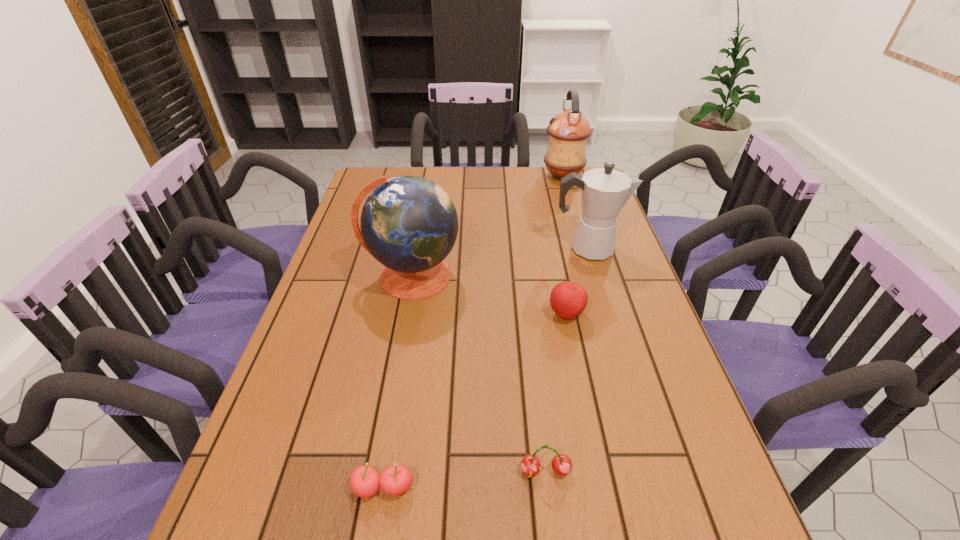
You are a GUI agent. You are given a task and a screenshot of the screen. Output one action in this format:
    pyautogui.click(x=<x>, y=<y>)
    Task: Click on the vacant point located between the globe and the coffeepot
    This screenshot has width=960, height=540.
    Given the screenshot: What is the action you would take?
    pyautogui.click(x=500, y=262)

Identify the location of free area in between the globe and the left cherry. The height and width of the screenshot is (540, 960). (397, 382).

Locate which object ranks second in proximity to the coffeepot. Please provide its 2D coordinates. Your answer should be formatted as a tuple, i.e. [(x, y)], where the tuple contains the x and y coordinates of a point satisfying the conditions above.

[(409, 224)]

Identify which object is the fourth closest to the left cherry. Please provide its 2D coordinates. Your answer should be formatted as a tuple, i.e. [(x, y)], where the tuple contains the x and y coordinates of a point satisfying the conditions above.

[(605, 191)]

Where is `vacant space that satisfies the following two spatial constraints: 1. with the Americas facing the viewer on the globe; 2. on the right side of the left cherry`? Image resolution: width=960 pixels, height=540 pixels. vacant space that satisfies the following two spatial constraints: 1. with the Americas facing the viewer on the globe; 2. on the right side of the left cherry is located at coordinates (374, 488).

The height and width of the screenshot is (540, 960). I want to click on free space that satisfies the following two spatial constraints: 1. on the back side of the apple; 2. on the right side of the coffeepot, so click(x=553, y=248).